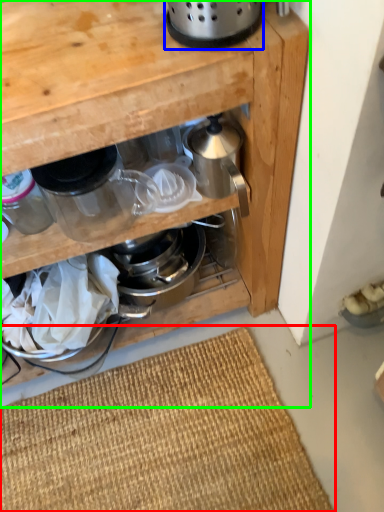
Question: Which is nearer to the doormat (highlighted by a red box)? appliance (highlighted by a blue box) or cabinetry (highlighted by a green box).

Choices:
 (A) appliance
 (B) cabinetry

Answer: (B)